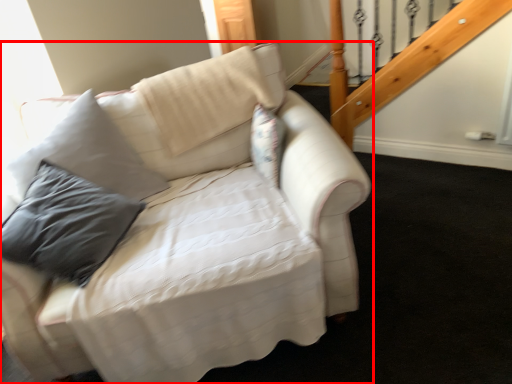
Question: From the image's perspective, where is studio couch (annotated by the red box) located relative to pillow?

Choices:
 (A) above
 (B) below

Answer: (B)